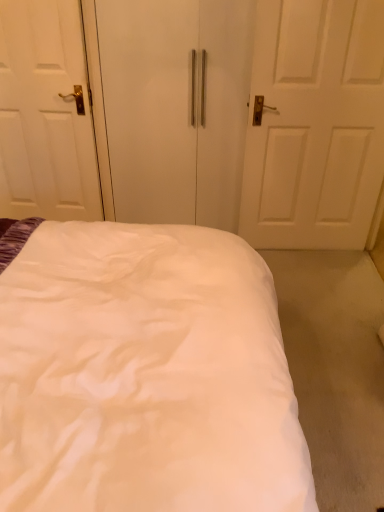
Question: Considering the relative sizes of white matte wardrobe at center and white glossy door at left in the image provided, is white matte wardrobe at center shorter than white glossy door at left?

Choices:
 (A) yes
 (B) no

Answer: (B)

Question: Is white matte wardrobe at center located outside white glossy door at left?

Choices:
 (A) no
 (B) yes

Answer: (B)

Question: Can you confirm if white matte wardrobe at center is bigger than white glossy door at left?

Choices:
 (A) yes
 (B) no

Answer: (A)

Question: Is white matte wardrobe at center further to the viewer compared to white glossy door at left?

Choices:
 (A) yes
 (B) no

Answer: (B)

Question: From a real-world perspective, is white matte wardrobe at center positioned under white glossy door at left based on gravity?

Choices:
 (A) yes
 (B) no

Answer: (A)

Question: Does white matte wardrobe at center have a smaller size compared to white glossy door at left?

Choices:
 (A) yes
 (B) no

Answer: (B)

Question: Is white glossy door at left far away from white matte wardrobe at center?

Choices:
 (A) no
 (B) yes

Answer: (A)

Question: From a real-world perspective, is white glossy door at left beneath white matte wardrobe at center?

Choices:
 (A) yes
 (B) no

Answer: (B)

Question: Does white glossy door at left have a lesser height compared to white matte wardrobe at center?

Choices:
 (A) yes
 (B) no

Answer: (A)

Question: Considering the relative sizes of white glossy door at left and white matte wardrobe at center in the image provided, is white glossy door at left taller than white matte wardrobe at center?

Choices:
 (A) yes
 (B) no

Answer: (B)

Question: Is white matte wardrobe at center completely or partially inside white glossy door at left?

Choices:
 (A) yes
 (B) no

Answer: (B)

Question: Is white glossy door at left facing towards white matte wardrobe at center?

Choices:
 (A) yes
 (B) no

Answer: (B)

Question: Is white fabric bed at center oriented away from white glossy door at left?

Choices:
 (A) yes
 (B) no

Answer: (B)